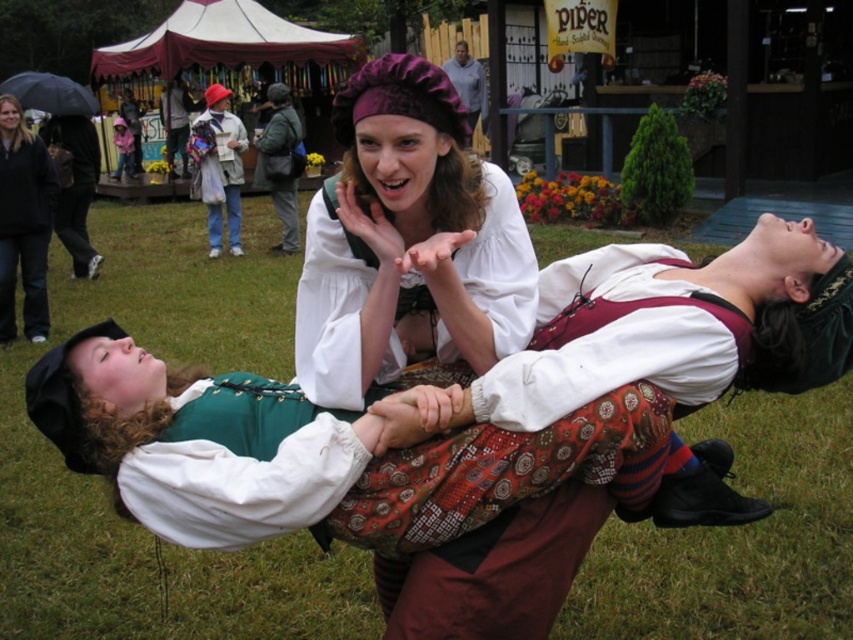
Can you confirm if denim jacket at left is positioned to the left of matte purple hat at upper center?

Correct, you'll find denim jacket at left to the left of matte purple hat at upper center.

Does denim jacket at left have a larger size compared to matte purple hat at upper center?

No.

Between point (45, 243) and point (469, 67), which one is positioned in front?

Point (45, 243) is in front.

Where is `denim jacket at left`? The image size is (853, 640). denim jacket at left is located at coordinates (24, 234).

How distant is black fabric umbrella at upper left from matte black jacket at upper center?

6.85 meters

In the scene shown: Is black fabric umbrella at upper left to the left of matte black jacket at upper center from the viewer's perspective?

No, black fabric umbrella at upper left is not to the left of matte black jacket at upper center.

Who is more forward, (61, 124) or (175, 84)?

Point (61, 124) is more forward.

Locate an element on the screen. black fabric umbrella at upper left is located at coordinates (74, 186).

Does point (397, 140) lie in front of point (469, 77)?

That is True.

Which is below, white cotton blouse at center or matte purple hat at upper center?

white cotton blouse at center is below.

You are a GUI agent. You are given a task and a screenshot of the screen. Output one action in this format:
    pyautogui.click(x=<x>, y=<y>)
    Task: Click on the white cotton blouse at center
    This screenshot has width=853, height=640.
    Given the screenshot: What is the action you would take?
    pyautogui.click(x=407, y=243)